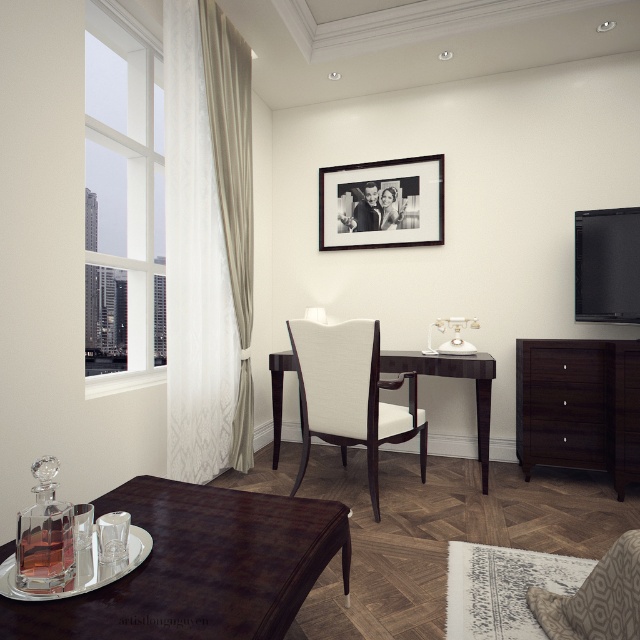
Question: Where is beige velvet curtain at left located in relation to black matte picture frame at upper center in the image?

Choices:
 (A) above
 (B) below

Answer: (B)

Question: Considering the relative positions of brown leather table at lower left and dark wood dresser at right in the image provided, where is brown leather table at lower left located with respect to dark wood dresser at right?

Choices:
 (A) below
 (B) above

Answer: (A)

Question: Which of the following is the closest to the observer?

Choices:
 (A) sheer beige curtain at left
 (B) brown leather table at lower left
 (C) dark wood drawer at right
 (D) white glass window at left

Answer: (B)

Question: Does sheer beige curtain at left have a lesser width compared to dark wood dresser at right?

Choices:
 (A) yes
 (B) no

Answer: (A)

Question: Which of these objects is positioned closest to the dark wood drawer at right?

Choices:
 (A) sheer beige curtain at left
 (B) dark wood dresser at right

Answer: (B)

Question: Which point is closer to the camera?

Choices:
 (A) (141, 278)
 (B) (561, 362)
 (C) (577, 458)

Answer: (A)